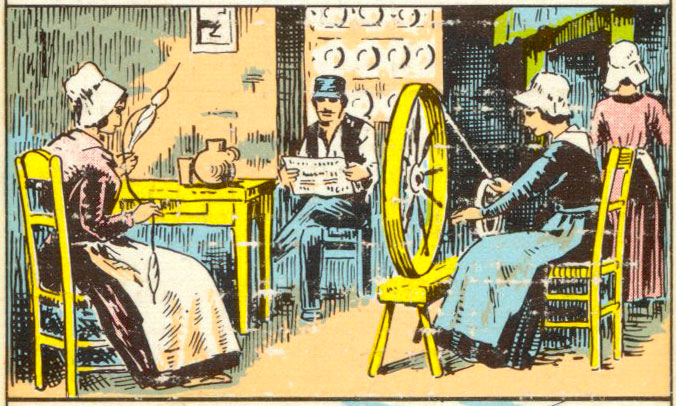
Where is `chair`? This screenshot has height=406, width=676. chair is located at coordinates (602, 217).